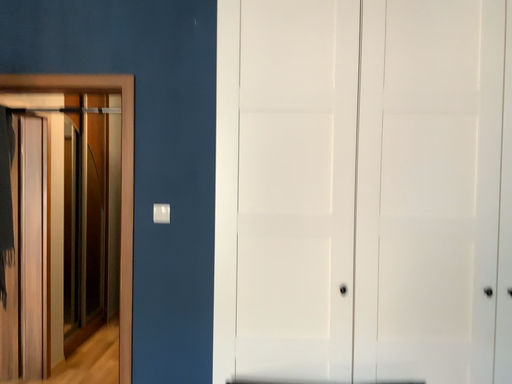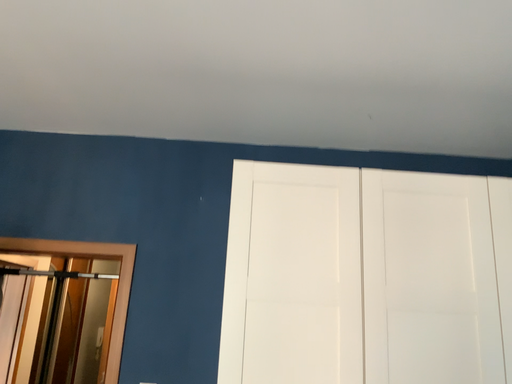
Question: How did the camera likely rotate when shooting the video?

Choices:
 (A) rotated upward
 (B) rotated downward

Answer: (A)